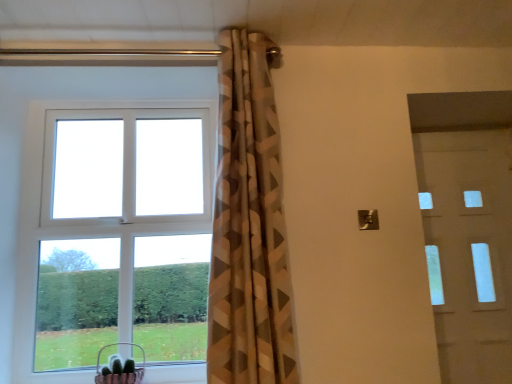
Question: Does white plastic window at upper left have a greater height compared to white glossy door at right?

Choices:
 (A) no
 (B) yes

Answer: (A)

Question: Is white plastic window at upper left positioned in front of white glossy door at right?

Choices:
 (A) no
 (B) yes

Answer: (B)

Question: Is white plastic window at upper left turned away from white glossy door at right?

Choices:
 (A) no
 (B) yes

Answer: (A)

Question: Does white plastic window at upper left turn towards white glossy door at right?

Choices:
 (A) yes
 (B) no

Answer: (B)

Question: Considering the relative sizes of white plastic window at upper left and white glossy door at right in the image provided, is white plastic window at upper left bigger than white glossy door at right?

Choices:
 (A) no
 (B) yes

Answer: (B)

Question: Is the depth of white plastic window at upper left greater than that of white glossy door at right?

Choices:
 (A) yes
 (B) no

Answer: (B)

Question: Is white glossy door at right to the right of white plastic window at upper left from the viewer's perspective?

Choices:
 (A) no
 (B) yes

Answer: (B)

Question: Considering the relative sizes of white glossy door at right and white plastic window at upper left in the image provided, is white glossy door at right wider than white plastic window at upper left?

Choices:
 (A) no
 (B) yes

Answer: (A)

Question: Is white glossy door at right outside white plastic window at upper left?

Choices:
 (A) yes
 (B) no

Answer: (A)

Question: From the image's perspective, does white glossy door at right appear higher than white plastic window at upper left?

Choices:
 (A) yes
 (B) no

Answer: (B)

Question: From a real-world perspective, does white glossy door at right stand above white plastic window at upper left?

Choices:
 (A) no
 (B) yes

Answer: (A)

Question: Can you confirm if white glossy door at right is positioned to the left of white plastic window at upper left?

Choices:
 (A) no
 (B) yes

Answer: (A)

Question: From a real-world perspective, does metallic pink basket at lower left stand above white plastic window at upper left?

Choices:
 (A) no
 (B) yes

Answer: (A)